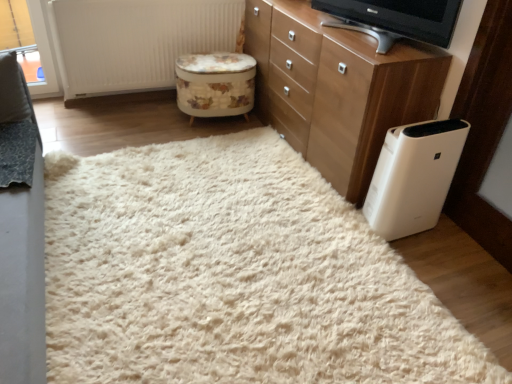
Question: Considering the relative positions of white plastic air purifier at lower right and matte black television at upper center in the image provided, is white plastic air purifier at lower right to the right of matte black television at upper center from the viewer's perspective?

Choices:
 (A) yes
 (B) no

Answer: (A)

Question: Can you confirm if white plastic air purifier at lower right is thinner than matte black television at upper center?

Choices:
 (A) yes
 (B) no

Answer: (B)

Question: Could you tell me if white plastic air purifier at lower right is facing matte black television at upper center?

Choices:
 (A) no
 (B) yes

Answer: (A)

Question: Is white plastic air purifier at lower right positioned before matte black television at upper center?

Choices:
 (A) yes
 (B) no

Answer: (B)

Question: Is matte black television at upper center at the back of white plastic air purifier at lower right?

Choices:
 (A) yes
 (B) no

Answer: (B)

Question: Is matte black television at upper center inside white plastic air purifier at lower right?

Choices:
 (A) yes
 (B) no

Answer: (B)

Question: Is white fluffy rug at center positioned with its back to white textured radiator at upper center?

Choices:
 (A) yes
 (B) no

Answer: (B)

Question: Can you confirm if white fluffy rug at center is shorter than white textured radiator at upper center?

Choices:
 (A) no
 (B) yes

Answer: (B)

Question: Considering the relative sizes of white fluffy rug at center and white textured radiator at upper center in the image provided, is white fluffy rug at center smaller than white textured radiator at upper center?

Choices:
 (A) yes
 (B) no

Answer: (B)

Question: From a real-world perspective, is white fluffy rug at center below white textured radiator at upper center?

Choices:
 (A) yes
 (B) no

Answer: (A)

Question: Is the position of white fluffy rug at center less distant than that of white textured radiator at upper center?

Choices:
 (A) yes
 (B) no

Answer: (A)

Question: Is white fluffy rug at center wider than white textured radiator at upper center?

Choices:
 (A) yes
 (B) no

Answer: (A)

Question: Does matte black television at upper center come in front of wooden chest of drawers at upper right?

Choices:
 (A) yes
 (B) no

Answer: (A)